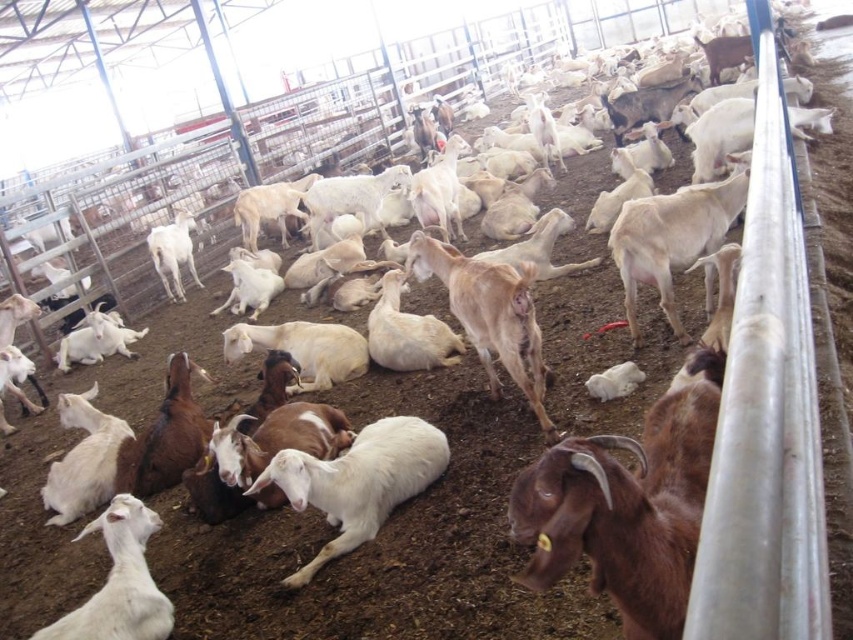
Question: Which of the following is the farthest from the observer?

Choices:
 (A) white woolen goat at center
 (B) brown fuzzy goat at lower right

Answer: (A)

Question: From the image, what is the correct spatial relationship of brown fuzzy goat at lower right in relation to white woolen goat at lower left?

Choices:
 (A) right
 (B) left

Answer: (A)

Question: Does brown fuzzy goat at lower right appear on the left side of white woolen goat at lower left?

Choices:
 (A) no
 (B) yes

Answer: (A)

Question: Which point is closer to the camera?

Choices:
 (A) (148, 609)
 (B) (374, 506)
 (C) (711, 348)

Answer: (C)

Question: Is white woolen goat at center positioned behind white woolen goat at lower left?

Choices:
 (A) no
 (B) yes

Answer: (B)

Question: Which object appears closest to the camera in this image?

Choices:
 (A) brown fuzzy goat at lower right
 (B) white woolen goat at center

Answer: (A)